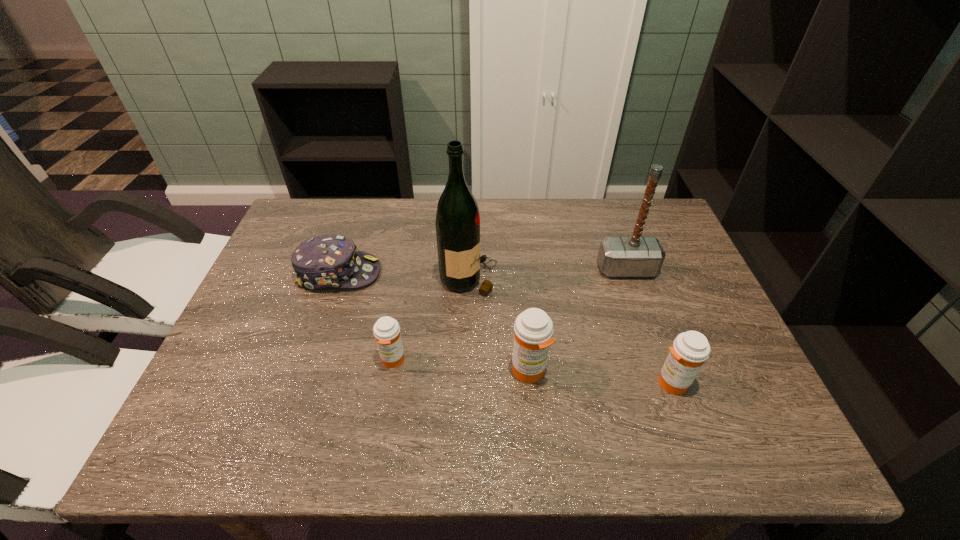
The height and width of the screenshot is (540, 960). In order to click on vacant area at the far edge of the desktop in this screenshot , I will do `click(360, 240)`.

Identify the location of blank area at the left edge. (288, 313).

Identify the location of free space at the right edge. (686, 291).

I want to click on vacant area at the far left corner of the desktop, so click(328, 203).

Identify the location of free space at the far right corner of the desktop. This screenshot has width=960, height=540. tap(621, 228).

Identify the location of free space that is in between the second medicine from left to right and the headwear. (434, 322).

Locate an element on the screen. Image resolution: width=960 pixels, height=540 pixels. free spot between the second tallest object and the shortest medicine is located at coordinates (510, 315).

This screenshot has width=960, height=540. Identify the location of free point between the second medicine from left to right and the fifth object from right to left. coord(461,366).

Identify the location of vacant region between the leftmost object and the fifth shortest object. This screenshot has height=540, width=960. (483, 271).

Locate an element on the screen. free space between the third object from left to right and the leftmost medicine is located at coordinates (431, 319).